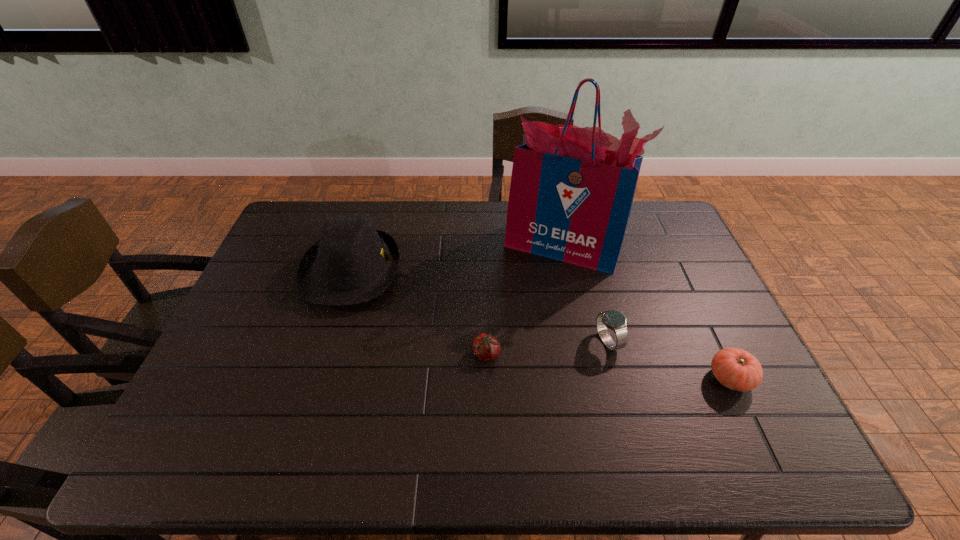
At what (x,y) coordinates should I click in order to perform the action: click on vacant space that's between the grocery bag and the fourth shortest object. Please return your answer as a coordinate pair (x, y). The height and width of the screenshot is (540, 960). Looking at the image, I should click on (457, 258).

Locate an element on the screen. The image size is (960, 540). unoccupied area between the right tomato and the left tomato is located at coordinates (609, 367).

Find the location of a particular element. The image size is (960, 540). object that is the second closest one to the leftmost object is located at coordinates (571, 193).

Choose which object is the third nearest neighbor to the watch. Please provide its 2D coordinates. Your answer should be formatted as a tuple, i.e. [(x, y)], where the tuple contains the x and y coordinates of a point satisfying the conditions above.

[(486, 347)]

At what (x,y) coordinates should I click in order to perform the action: click on blank space that satisfies the following two spatial constraints: 1. on the front-facing side of the grocery bag; 2. on the front-facing side of the leftmost object. Please return your answer as a coordinate pair (x, y). Looking at the image, I should click on (567, 271).

You are a GUI agent. You are given a task and a screenshot of the screen. Output one action in this format:
    pyautogui.click(x=<x>, y=<y>)
    Task: Click on the free spot that satisfies the following two spatial constraints: 1. on the front-facing side of the second tallest object; 2. on the back side of the shorter tomato
    
    Given the screenshot: What is the action you would take?
    pyautogui.click(x=325, y=354)

Image resolution: width=960 pixels, height=540 pixels. What are the coordinates of `free location that satisfies the following two spatial constraints: 1. on the front-facing side of the second tallest object; 2. on the left side of the watch` in the screenshot? It's located at (329, 342).

Where is `vacant space that satisfies the following two spatial constraints: 1. on the front-facing side of the shorter tomato; 2. on the left side of the leftmost object`? Image resolution: width=960 pixels, height=540 pixels. vacant space that satisfies the following two spatial constraints: 1. on the front-facing side of the shorter tomato; 2. on the left side of the leftmost object is located at coordinates (325, 354).

This screenshot has height=540, width=960. What are the coordinates of `vacant space that satisfies the following two spatial constraints: 1. on the front-facing side of the shortest object; 2. on the left side of the fourth shortest object` in the screenshot? It's located at (325, 354).

The image size is (960, 540). I want to click on free spot that satisfies the following two spatial constraints: 1. on the front-facing side of the watch; 2. on the right side of the fedora, so click(329, 342).